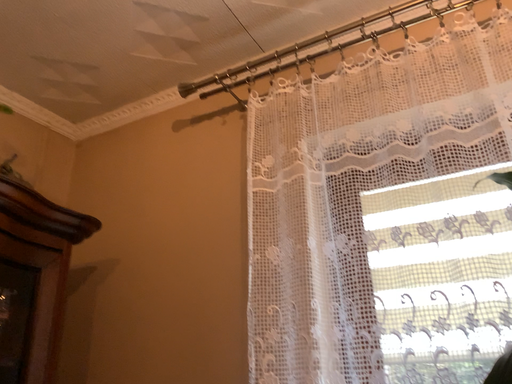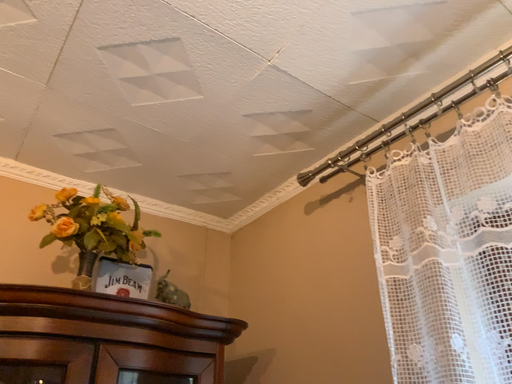
Question: Which way did the camera rotate in the video?

Choices:
 (A) rotated left
 (B) rotated right

Answer: (A)